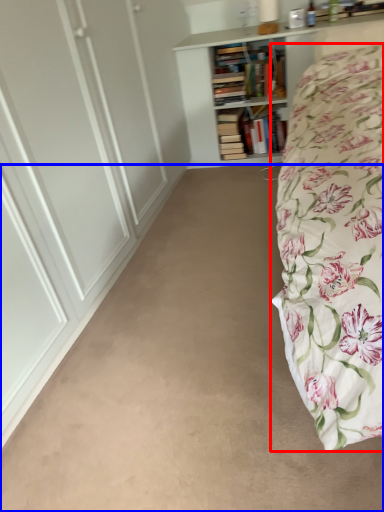
Question: Which point is closer to the camera, bed (highlighted by a red box) or plain (highlighted by a blue box)?

Choices:
 (A) bed
 (B) plain

Answer: (A)